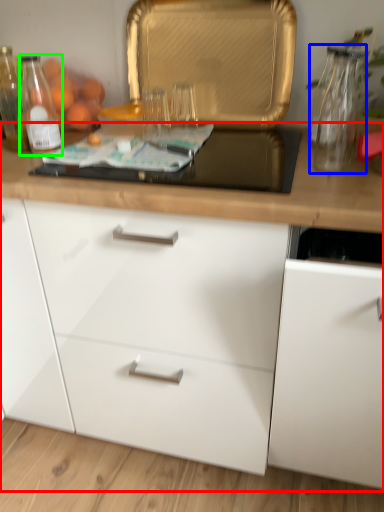
Question: Considering the real-world distances, which object is closest to cabinetry (highlighted by a red box)? glass vase (highlighted by a blue box) or bottle (highlighted by a green box).

Choices:
 (A) glass vase
 (B) bottle

Answer: (A)